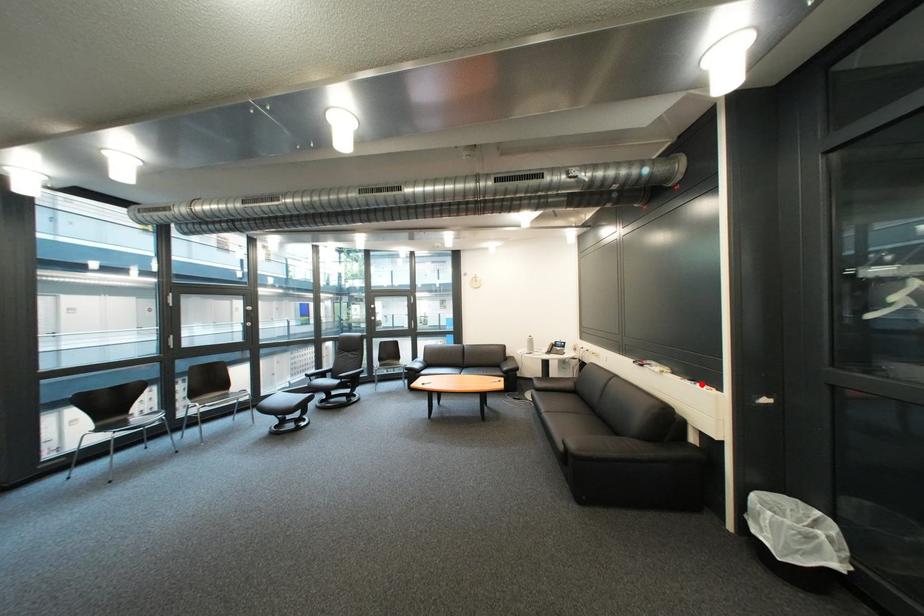
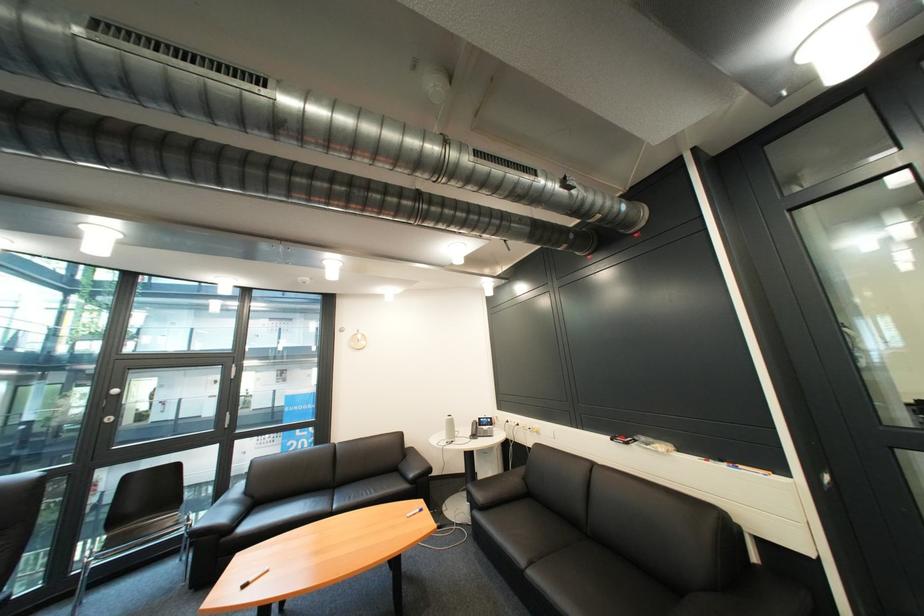
In the second image, find the point that corresponds to the highlighted location in the first image.

(736, 468)